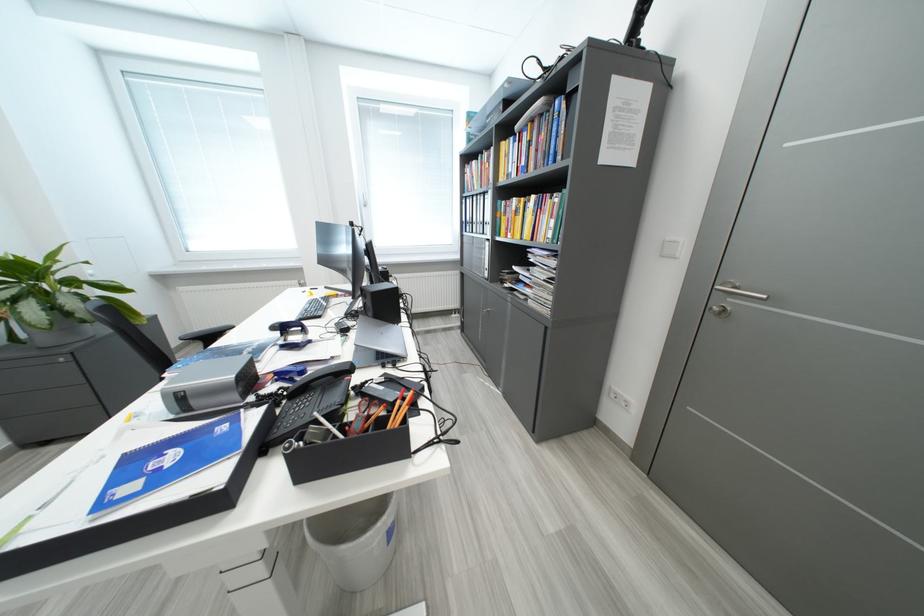
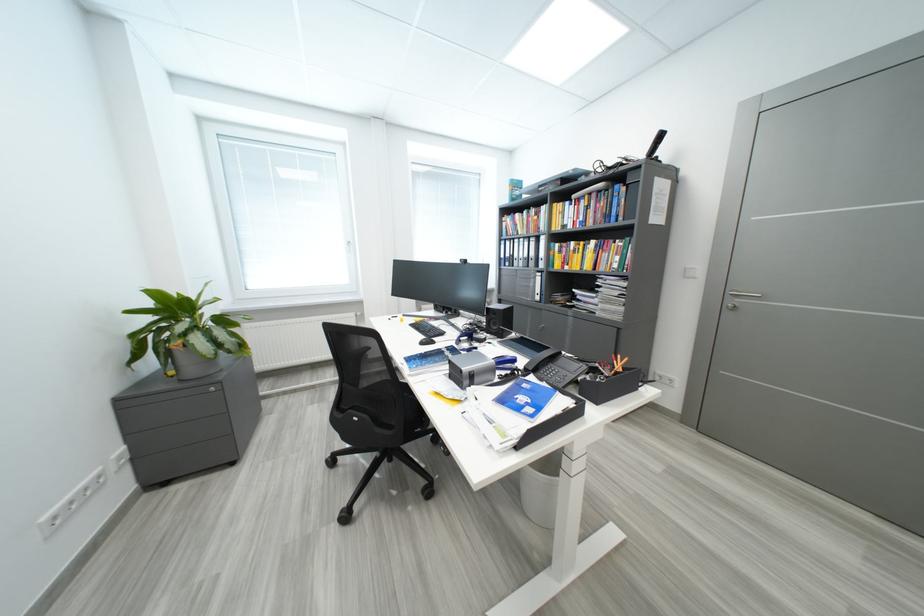
Find the pixel in the second image that matches (189,403) in the first image.

(481, 381)